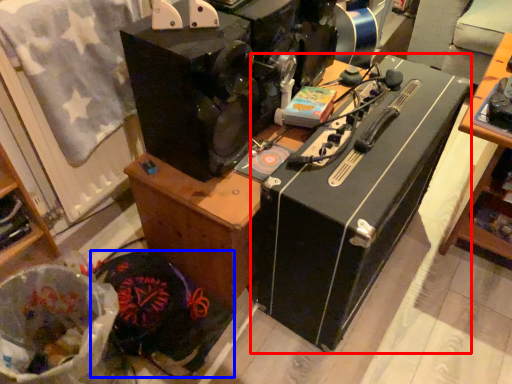
Question: Which object appears closest to the camera in this image, wide (highlighted by a red box) or waste (highlighted by a blue box)?

Choices:
 (A) wide
 (B) waste

Answer: (A)